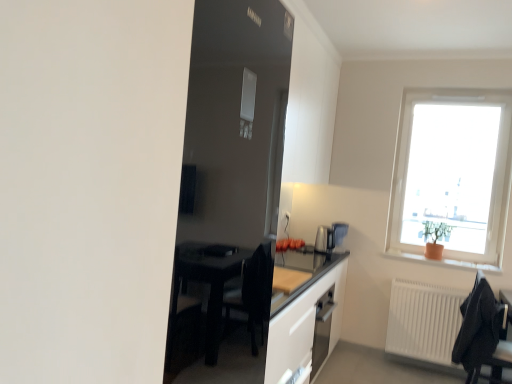
The image size is (512, 384). Identify the location of free location above white matte radiator at lower right (from a real-world perspective). (440, 276).